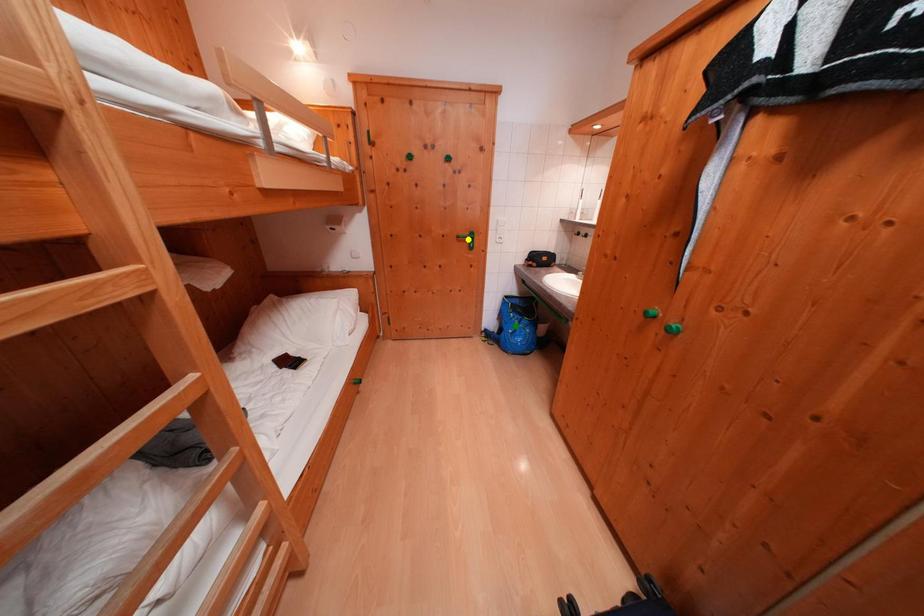
Order these from nearest to farthest:
A) green point
B) yellow point
C) red point

yellow point < red point < green point